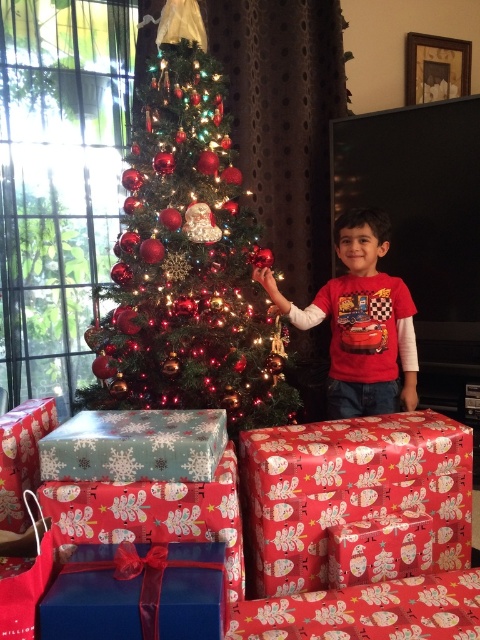
Is shiny green christmas tree at center to the right of red wrapping paper gift at center from the viewer's perspective?

In fact, shiny green christmas tree at center is to the left of red wrapping paper gift at center.

Can you confirm if shiny green christmas tree at center is shorter than red wrapping paper gift at center?

In fact, shiny green christmas tree at center may be taller than red wrapping paper gift at center.

Is point (159, 250) closer to camera compared to point (398, 420)?

No.

You are a GUI agent. You are given a task and a screenshot of the screen. Output one action in this format:
    pyautogui.click(x=<x>, y=<y>)
    Task: Click on the shiny green christmas tree at center
    The width and height of the screenshot is (480, 640).
    Given the screenshot: What is the action you would take?
    pyautogui.click(x=187, y=266)

How distant is shiny green christmas tree at center from red matte shirt at center?

shiny green christmas tree at center is 14.67 inches from red matte shirt at center.

Is point (117, 369) farther from camera compared to point (416, 352)?

That is False.

What are the coordinates of `shiny green christmas tree at center` in the screenshot? It's located at (187, 266).

Between red wrapping paper gift at center and red matte shirt at center, which one is positioned lower?

red wrapping paper gift at center is below.

Is red wrapping paper gift at center below red matte shirt at center?

Correct, red wrapping paper gift at center is located below red matte shirt at center.

Between point (289, 547) and point (415, 388), which one is positioned in front?

Positioned in front is point (289, 547).

At what (x,y) coordinates should I click in order to perform the action: click on red wrapping paper gift at center. Please return your answer as a coordinate pair (x, y). Looking at the image, I should click on (357, 500).